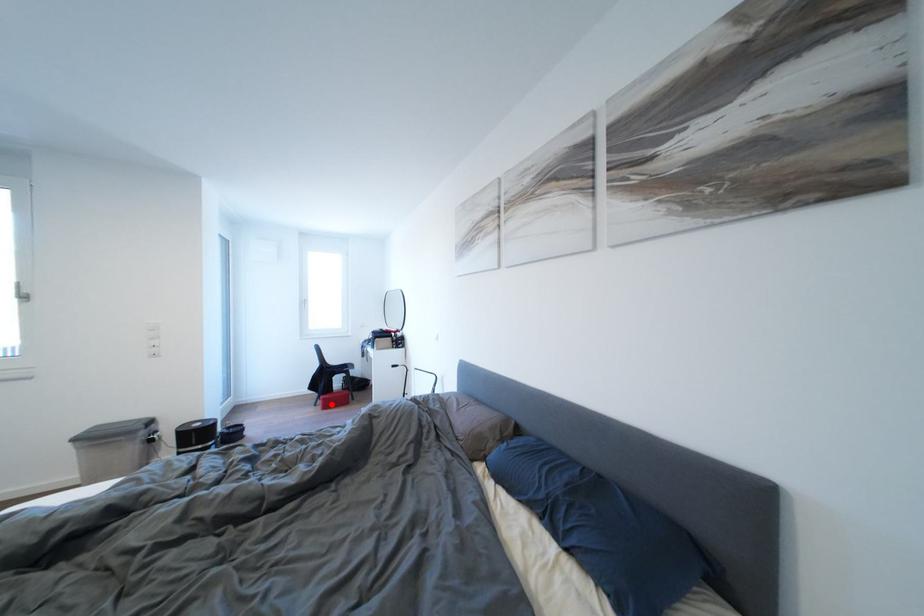
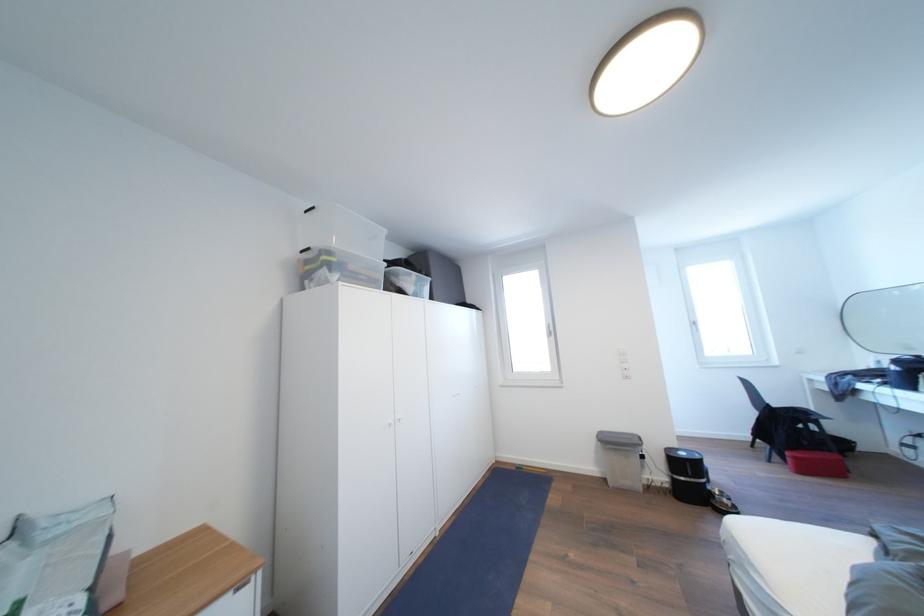
Question: A red point is marked in image1. In image2, is the corresponding 3D point closer to the camera or farther? Reply with the corresponding letter.

Choices:
 (A) The corresponding 3D point is closer.
 (B) The corresponding 3D point is farther.

Answer: (A)